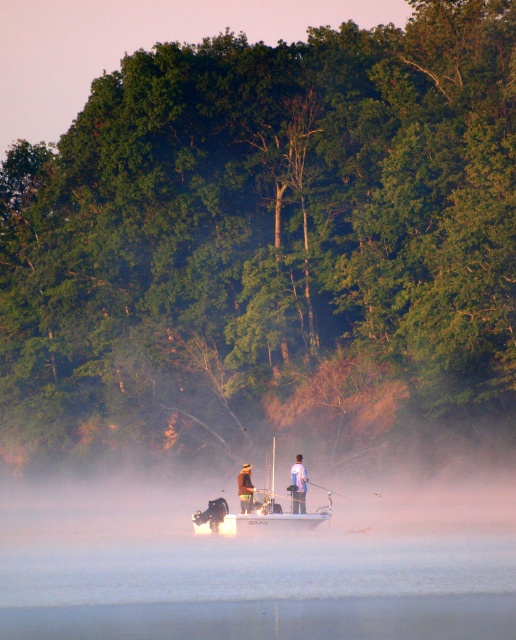
Question: Is white plastic boat at center positioned behind brown leather jacket at center?

Choices:
 (A) no
 (B) yes

Answer: (A)

Question: Can you confirm if white plastic boat at center is thinner than blue fabric shirt at center?

Choices:
 (A) yes
 (B) no

Answer: (B)

Question: Is blue fabric shirt at center to the right of brown leather jacket at center from the viewer's perspective?

Choices:
 (A) no
 (B) yes

Answer: (B)

Question: Which point is farther to the camera?

Choices:
 (A) white plastic boat at center
 (B) brown leather jacket at center

Answer: (B)

Question: Which of these objects is positioned closest to the white plastic boat at center?

Choices:
 (A) blue fabric shirt at center
 (B) brown leather jacket at center

Answer: (B)

Question: Estimate the real-world distances between objects in this image. Which object is farther from the white plastic boat at center?

Choices:
 (A) blue fabric shirt at center
 (B) brown leather jacket at center

Answer: (A)